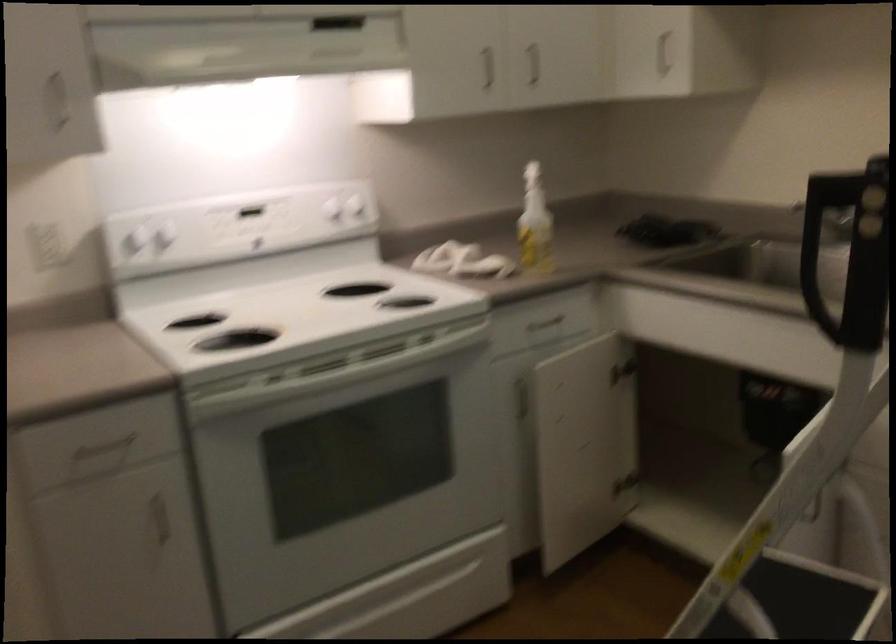
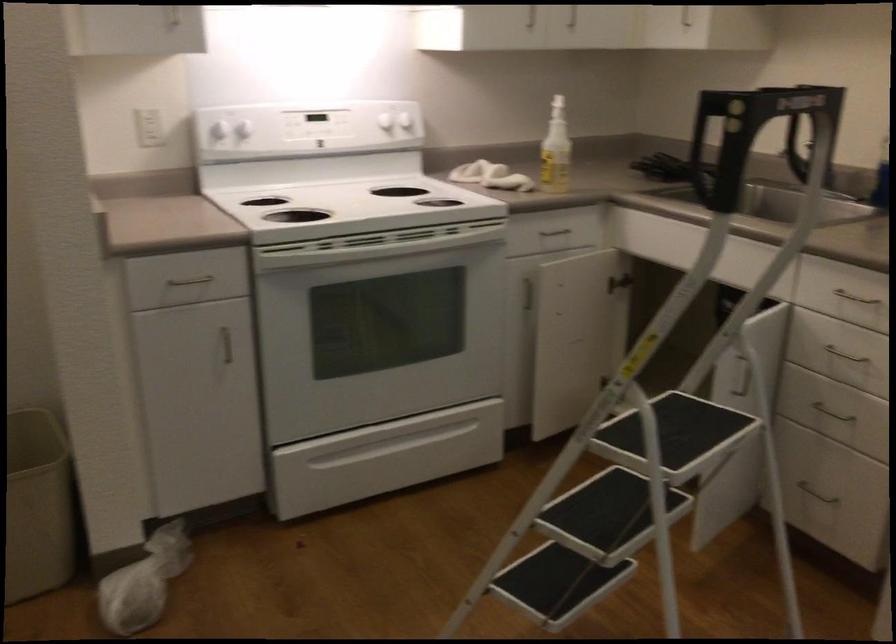
Locate, in the second image, the point that corresponds to [536,82] in the first image.

(573, 24)